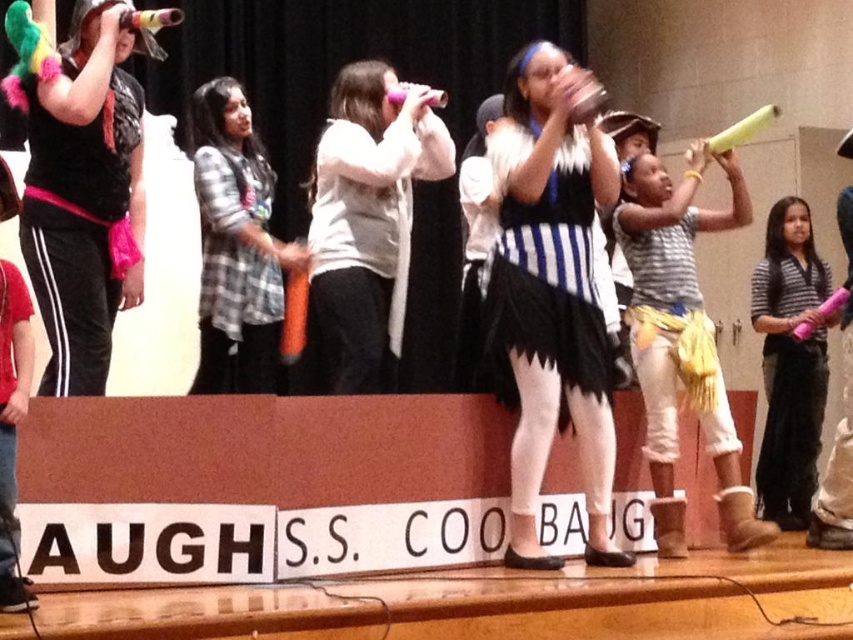
Between white matte skirt at center and checkered fabric shirt at center, which one is positioned higher?

checkered fabric shirt at center is higher up.

Can you confirm if white matte skirt at center is thinner than checkered fabric shirt at center?

Yes.

What do you see at coordinates (552, 291) in the screenshot?
I see `white matte skirt at center` at bounding box center [552, 291].

You are a GUI agent. You are given a task and a screenshot of the screen. Output one action in this format:
    pyautogui.click(x=<x>, y=<y>)
    Task: Click on the white matte skirt at center
    This screenshot has width=853, height=640.
    Given the screenshot: What is the action you would take?
    pyautogui.click(x=552, y=291)

Does matte black hoodie at upper left have a larger size compared to black and white striped skirt at center?

Indeed, matte black hoodie at upper left has a larger size compared to black and white striped skirt at center.

Does matte black hoodie at upper left come behind black and white striped skirt at center?

No, matte black hoodie at upper left is in front of black and white striped skirt at center.

The height and width of the screenshot is (640, 853). Find the location of `matte black hoodie at upper left`. matte black hoodie at upper left is located at coordinates (85, 195).

Does white matte scarf at center have a lesser width compared to yellow corduroy skirt at center?

No, white matte scarf at center is not thinner than yellow corduroy skirt at center.

Is white matte scarf at center above yellow corduroy skirt at center?

Yes, white matte scarf at center is above yellow corduroy skirt at center.

What do you see at coordinates (364, 225) in the screenshot? This screenshot has width=853, height=640. I see `white matte scarf at center` at bounding box center [364, 225].

The width and height of the screenshot is (853, 640). I want to click on white matte scarf at center, so click(x=364, y=225).